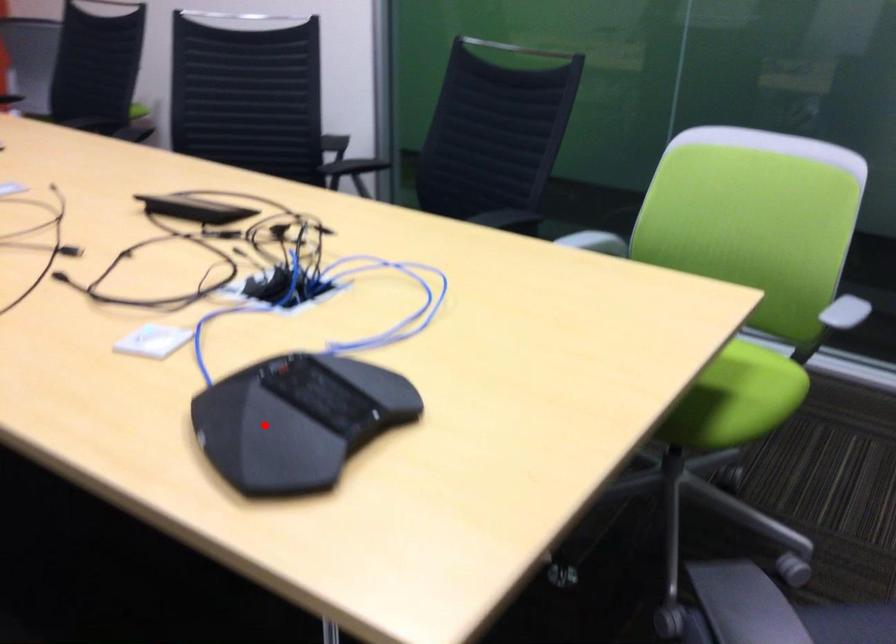
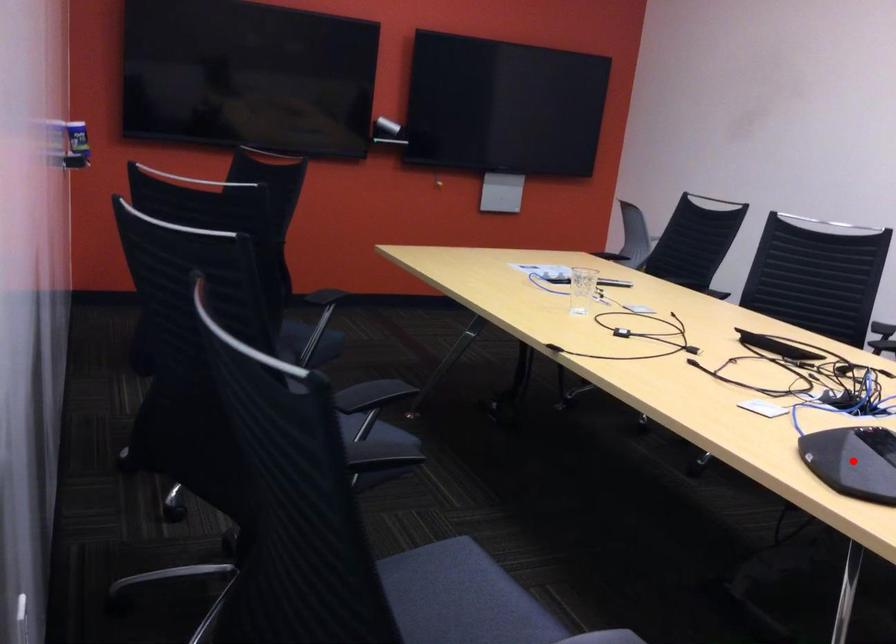
I am providing you with two images of the same scene from different viewpoints. A red point is marked on the first image and another point is marked on the second image. Is the red point in image1 aligned with the point shown in image2?

Yes